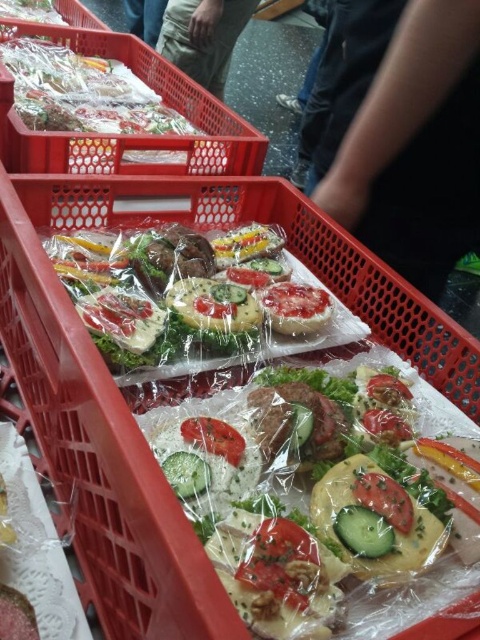
Question: Does clear plastic sandwiches at center appear on the right side of translucent plastic salad at center?

Choices:
 (A) yes
 (B) no

Answer: (B)

Question: Which point is closer to the camera taking this photo?

Choices:
 (A) (235, 305)
 (B) (324, 522)

Answer: (B)

Question: Can you confirm if translucent plastic salad at center is thinner than translucent plastic sandwiches at center?

Choices:
 (A) yes
 (B) no

Answer: (A)

Question: Which of the following is the closest to the observer?

Choices:
 (A) (316, 244)
 (B) (177, 312)

Answer: (B)

Question: Can you confirm if clear plastic sandwiches at center is bigger than clear plastic sandwiches at upper left?

Choices:
 (A) no
 (B) yes

Answer: (A)

Question: Which object appears farthest from the camera in this image?

Choices:
 (A) translucent plastic salad at center
 (B) clear plastic sandwiches at center

Answer: (A)